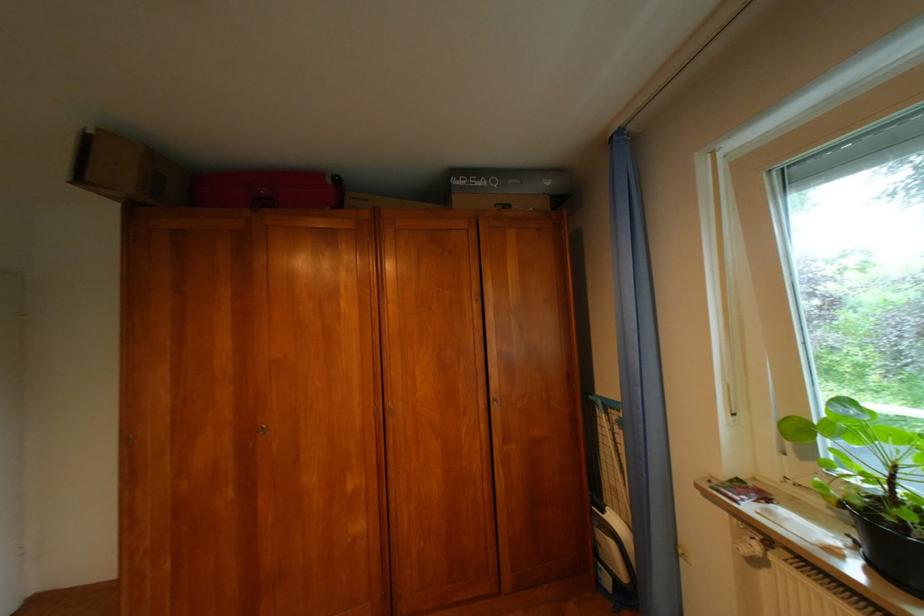
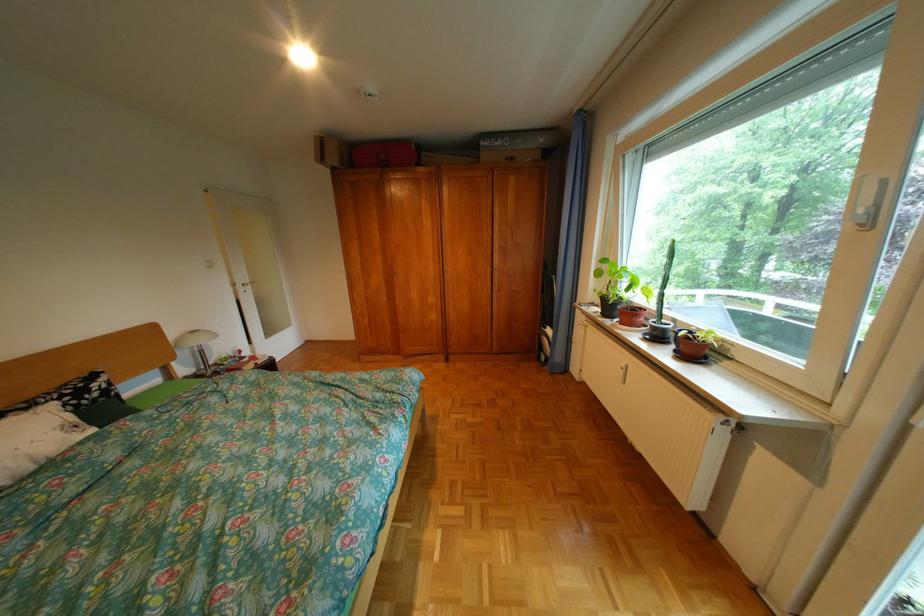
Locate, in the second image, the point that corresponds to point 468,182 in the first image.

(497, 145)